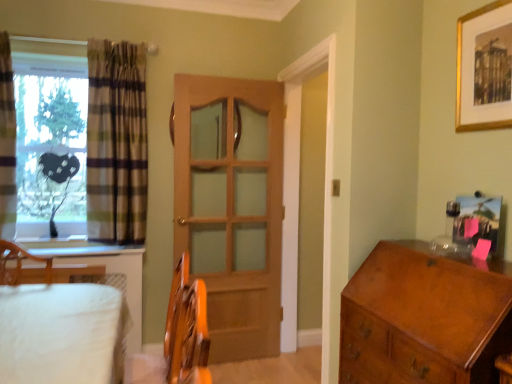
Question: Is wooden door at center positioned beyond the bounds of plaid fabric curtain at left, positioned as the second curtain in left-to-right order?

Choices:
 (A) yes
 (B) no

Answer: (A)

Question: From a real-world perspective, is wooden door at center on plaid fabric curtain at left, positioned as the 1th curtain in right-to-left order?

Choices:
 (A) yes
 (B) no

Answer: (B)

Question: Is wooden door at center aimed at plaid fabric curtain at left, positioned as the second curtain in left-to-right order?

Choices:
 (A) yes
 (B) no

Answer: (B)

Question: Does wooden door at center have a lesser height compared to plaid fabric curtain at left, positioned as the second curtain in left-to-right order?

Choices:
 (A) no
 (B) yes

Answer: (A)

Question: Is wooden door at center surrounding plaid fabric curtain at left, positioned as the 1th curtain in right-to-left order?

Choices:
 (A) yes
 (B) no

Answer: (B)

Question: Is wooden door at center at the right side of plaid fabric curtain at left, positioned as the second curtain in left-to-right order?

Choices:
 (A) no
 (B) yes

Answer: (B)

Question: Considering the relative sizes of gold metallic picture frame at upper right, positioned as the first picture frame in top-to-bottom order, and plaid fabric curtain at left, the 1th curtain when ordered from left to right, in the image provided, is gold metallic picture frame at upper right, positioned as the first picture frame in top-to-bottom order, smaller than plaid fabric curtain at left, the 1th curtain when ordered from left to right,?

Choices:
 (A) yes
 (B) no

Answer: (A)

Question: From the image's perspective, is gold metallic picture frame at upper right, positioned as the first picture frame in top-to-bottom order, under plaid fabric curtain at left, the 1th curtain when ordered from left to right?

Choices:
 (A) yes
 (B) no

Answer: (B)

Question: Is gold metallic picture frame at upper right, positioned as the first picture frame in top-to-bottom order, positioned behind plaid fabric curtain at left, the 1th curtain when ordered from left to right?

Choices:
 (A) no
 (B) yes

Answer: (A)

Question: Could you tell me if gold metallic picture frame at upper right, the 2th picture frame positioned from the bottom, is facing plaid fabric curtain at left, the 1th curtain when ordered from left to right?

Choices:
 (A) no
 (B) yes

Answer: (A)

Question: Does gold metallic picture frame at upper right, the 2th picture frame positioned from the bottom, appear on the left side of plaid fabric curtain at left, the 1th curtain when ordered from left to right?

Choices:
 (A) yes
 (B) no

Answer: (B)

Question: Is gold metallic picture frame at upper right, positioned as the first picture frame in top-to-bottom order, facing away from plaid fabric curtain at left, positioned as the second curtain in right-to-left order?

Choices:
 (A) no
 (B) yes

Answer: (A)

Question: Can you see plaid fabric curtain at left, positioned as the second curtain in right-to-left order, touching transparent plastic heart at left?

Choices:
 (A) no
 (B) yes

Answer: (A)